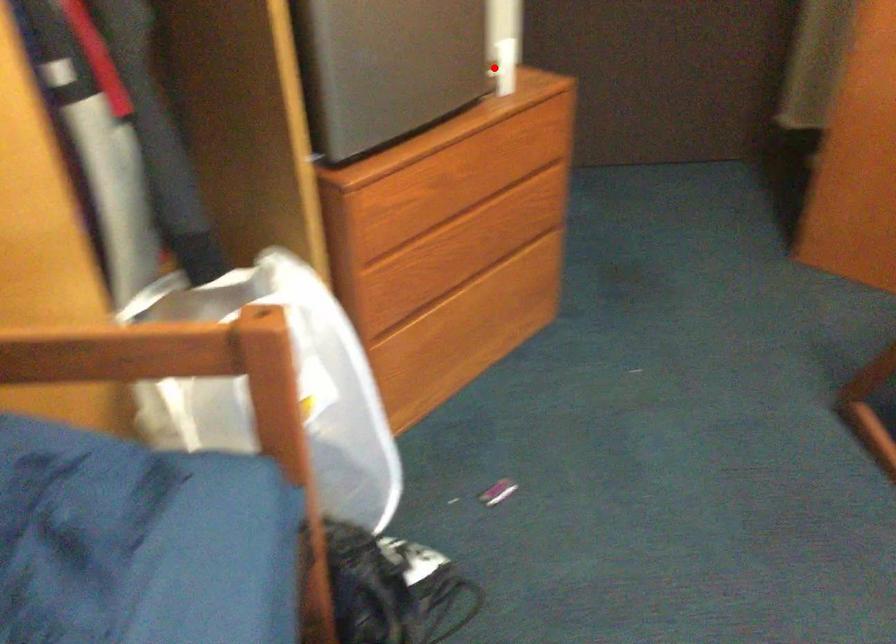
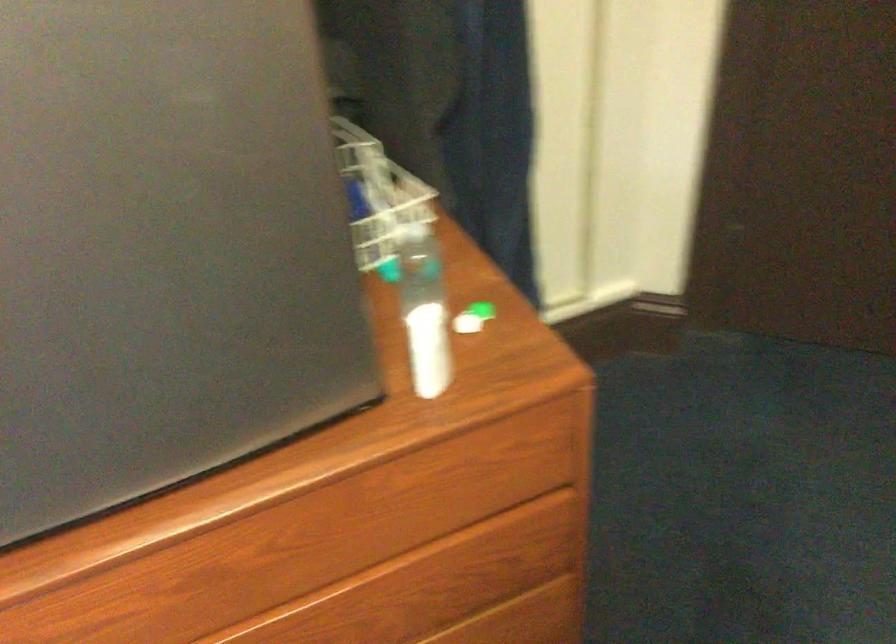
Question: I am providing you with two images of the same scene from different viewpoints. A red point is marked on the first image. At the location where the point appears in image 1, is it still visible in image 2?

Choices:
 (A) Yes
 (B) No

Answer: (A)